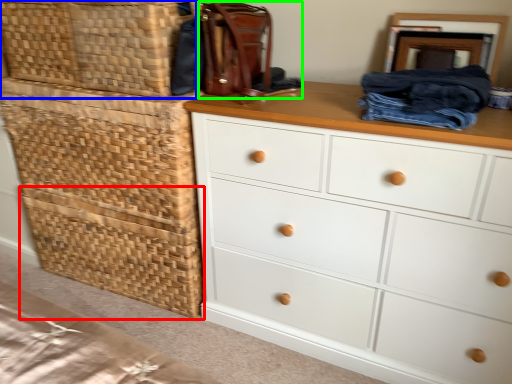
Question: Estimate the real-world distances between objects in this image. Which object is farther from basket (highlighted by a red box), basket (highlighted by a blue box) or handbag (highlighted by a green box)?

Choices:
 (A) basket
 (B) handbag

Answer: (B)